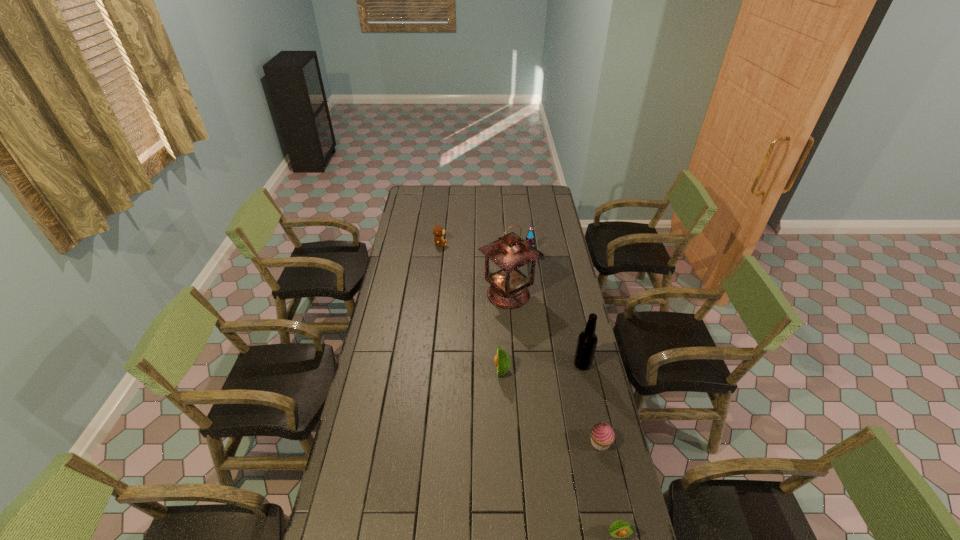
Where is `free point that satisfies the following two spatial constraints: 1. on the face of the teddy bear; 2. on the back side of the sixth shortest object`? free point that satisfies the following two spatial constraints: 1. on the face of the teddy bear; 2. on the back side of the sixth shortest object is located at coordinates (427, 364).

The width and height of the screenshot is (960, 540). I want to click on vacant point that satisfies the following two spatial constraints: 1. on the front side of the cupcake; 2. on the right side of the tallest object, so click(x=518, y=442).

This screenshot has height=540, width=960. Find the location of `vacant space that satisfies the following two spatial constraints: 1. on the face of the teddy bear; 2. on the right side of the soda`. vacant space that satisfies the following two spatial constraints: 1. on the face of the teddy bear; 2. on the right side of the soda is located at coordinates (440, 250).

Find the location of a particular element. Image resolution: width=960 pixels, height=540 pixels. free space that satisfies the following two spatial constraints: 1. on the front side of the cupcake; 2. on the right side of the second tallest object is located at coordinates (599, 442).